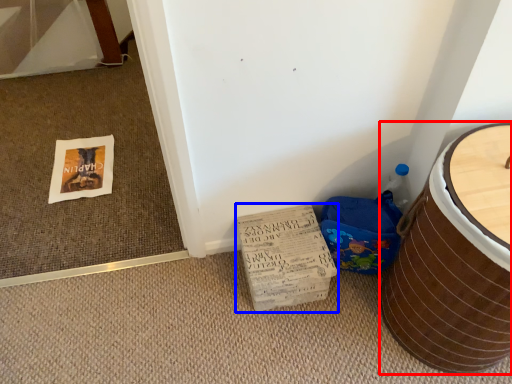
Question: Which point is closer to the camera, furniture (highlighted by a red box) or cardboard (highlighted by a blue box)?

Choices:
 (A) furniture
 (B) cardboard

Answer: (A)